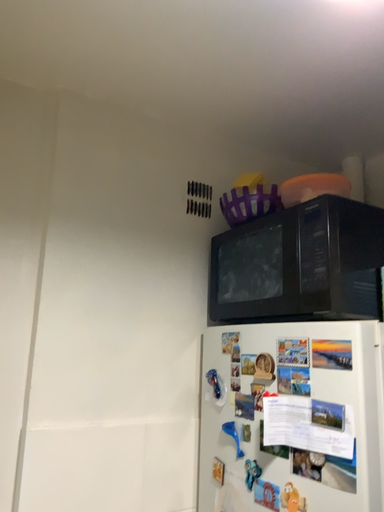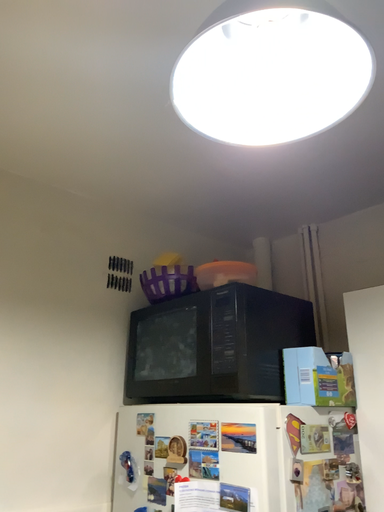
Question: How did the camera likely rotate when shooting the video?

Choices:
 (A) rotated right
 (B) rotated left

Answer: (A)